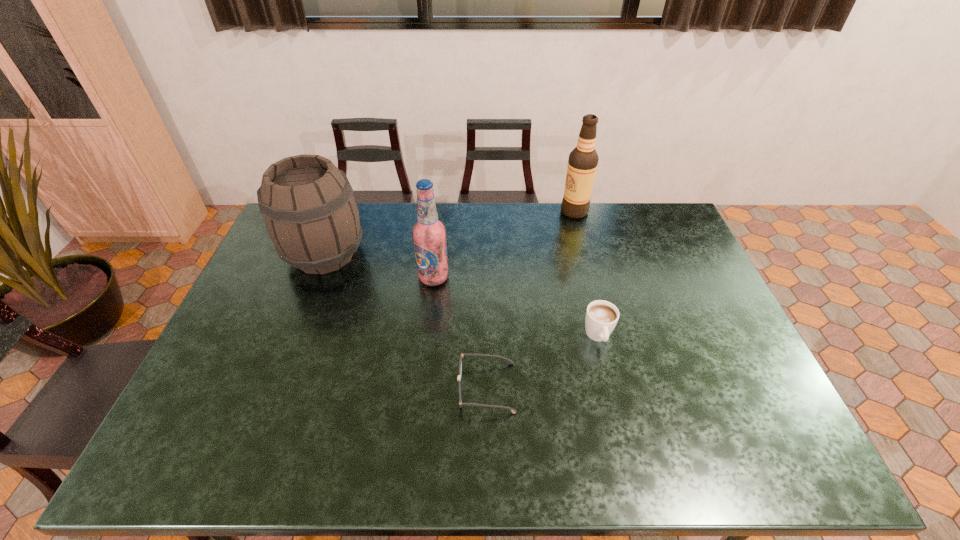
Locate an element on the screen. the right alcohol is located at coordinates (582, 164).

This screenshot has height=540, width=960. Identify the location of the farthest object. (582, 164).

Identify the location of the nearer alcohol. 429,234.

Identify the location of the second object from left to right. The width and height of the screenshot is (960, 540). (429, 234).

Locate an element on the screen. The height and width of the screenshot is (540, 960). wine bucket is located at coordinates (311, 216).

Where is `cappuccino`? cappuccino is located at coordinates (602, 316).

Find the location of a particular element. The width and height of the screenshot is (960, 540). the second nearest object is located at coordinates pos(602,316).

The width and height of the screenshot is (960, 540). In order to click on the third object from right to left in this screenshot , I will do `click(512, 410)`.

Locate an element on the screen. The width and height of the screenshot is (960, 540). the shortest object is located at coordinates (512, 410).

Where is `free spot located 0.260m on the label of the right alcohol`? free spot located 0.260m on the label of the right alcohol is located at coordinates (493, 211).